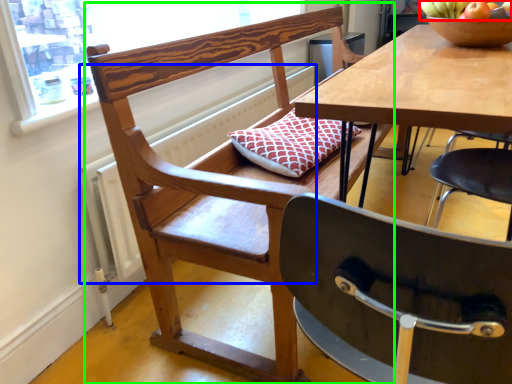
Question: Based on their relative distances, which object is farther from fruit (highlighted by a red box)? Choose from radiator (highlighted by a blue box) and chair (highlighted by a green box).

Choices:
 (A) radiator
 (B) chair

Answer: (A)